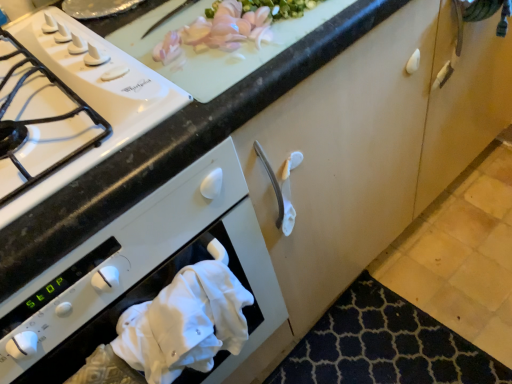
Measure the distance between dark blue textured mat at lower right and camera.

dark blue textured mat at lower right and camera are 3.58 feet apart from each other.

This screenshot has height=384, width=512. Identify the location of white cotton hand towel at lower left. (185, 323).

From a real-world perspective, is white fabric at lower left on top of white cotton hand towel at lower left?

No, from a real-world perspective, white fabric at lower left is not above white cotton hand towel at lower left.

Between white fabric at lower left and white cotton hand towel at lower left, which one appears on the left side from the viewer's perspective?

white fabric at lower left is more to the left.

Is white cotton hand towel at lower left inside white fabric at lower left?

Yes, white fabric at lower left contains white cotton hand towel at lower left.

I want to click on hand towel on the right of white fabric at lower left, so click(185, 323).

Considering the relative sizes of white cotton hand towel at lower left and dark blue textured mat at lower right in the image provided, is white cotton hand towel at lower left wider than dark blue textured mat at lower right?

Incorrect, the width of white cotton hand towel at lower left does not surpass that of dark blue textured mat at lower right.

Is there a large distance between white cotton hand towel at lower left and dark blue textured mat at lower right?

They are positioned close to each other.

Does white cotton hand towel at lower left have a greater height compared to dark blue textured mat at lower right?

Correct, white cotton hand towel at lower left is much taller as dark blue textured mat at lower right.

From a real-world perspective, does white cotton hand towel at lower left stand above dark blue textured mat at lower right?

Yes, from a real-world perspective, white cotton hand towel at lower left is above dark blue textured mat at lower right.

Is white cloth at lower left wider than dark blue textured mat at lower right?

In fact, white cloth at lower left might be narrower than dark blue textured mat at lower right.

Consider the image. Is white cloth at lower left next to dark blue textured mat at lower right?

There is a gap between white cloth at lower left and dark blue textured mat at lower right.

This screenshot has height=384, width=512. Identify the location of hand lying above the dark blue textured mat at lower right (from the image's perspective). tap(106, 369).

Is white cloth at lower left facing towards dark blue textured mat at lower right?

No, white cloth at lower left is not aimed at dark blue textured mat at lower right.

From a real-world perspective, is white fabric at lower left above or below dark blue textured mat at lower right?

In terms of real-world spatial position, white fabric at lower left is above dark blue textured mat at lower right.

Based on the photo, which is closer, (x=165, y=220) or (x=504, y=379)?

The point (x=165, y=220) is closer to the camera.

Is dark blue textured mat at lower right completely or partially inside white fabric at lower left?

No, dark blue textured mat at lower right is not surrounded by white fabric at lower left.

Between white fabric at lower left and dark blue textured mat at lower right, which one appears on the left side from the viewer's perspective?

From the viewer's perspective, white fabric at lower left appears more on the left side.

Is white cotton hand towel at lower left positioned with its back to white fabric at lower left?

Yes, white cotton hand towel at lower left is positioned with its back facing white fabric at lower left.

Is white cotton hand towel at lower left in front of or behind white fabric at lower left in the image?

white cotton hand towel at lower left is positioned farther from the viewer than white fabric at lower left.

I want to click on hand towel above the white fabric at lower left (from the image's perspective), so click(x=185, y=323).

Between white fabric at lower left and white glossy gas stove at left, which one has smaller width?

white glossy gas stove at left.

From the image's perspective, is white fabric at lower left beneath white glossy gas stove at left?

Yes, from the image's perspective, white fabric at lower left is below white glossy gas stove at left.

Is white glossy gas stove at left located within white fabric at lower left?

No, white glossy gas stove at left is not a part of white fabric at lower left.

Is white fabric at lower left to the left or to the right of white glossy gas stove at left in the image?

In the image, white fabric at lower left appears on the right side of white glossy gas stove at left.

Between point (487, 365) and point (266, 249), which one is positioned behind?

The point (487, 365) is behind.

Would you say dark blue textured mat at lower right contains white fabric at lower left?

No, white fabric at lower left is not surrounded by dark blue textured mat at lower right.

Does dark blue textured mat at lower right have a lesser height compared to white fabric at lower left?

Yes, dark blue textured mat at lower right is shorter than white fabric at lower left.

At what (x,y) coordinates should I click in order to perform the action: click on mat directly beneath the white fabric at lower left (from a real-world perspective). Please return your answer as a coordinate pair (x, y). Looking at the image, I should click on coord(384,345).

You are a GUI agent. You are given a task and a screenshot of the screen. Output one action in this format:
    pyautogui.click(x=<x>, y=<y>)
    Task: Click on the oven that is below the white cotton hand towel at lower left (from the image's perspective)
    Image resolution: width=512 pixels, height=384 pixels.
    Given the screenshot: What is the action you would take?
    pyautogui.click(x=141, y=275)

Where is `mat on the right of white cotton hand towel at lower left`? The image size is (512, 384). mat on the right of white cotton hand towel at lower left is located at coordinates (x=384, y=345).

Which object lies nearer to the anchor point white cloth at lower left, white cotton hand towel at lower left or dark blue textured mat at lower right?

Among the two, white cotton hand towel at lower left is located nearer to white cloth at lower left.

Consider the image. Which object lies nearer to the anchor point white fabric at lower left, white cloth at lower left or white glossy gas stove at left?

white cloth at lower left is closer to white fabric at lower left.

Which object lies further to the anchor point white cloth at lower left, white fabric at lower left or white glossy gas stove at left?

white glossy gas stove at left is further to white cloth at lower left.

Estimate the real-world distances between objects in this image. Which object is further from white cloth at lower left, white fabric at lower left or white cotton hand towel at lower left?

white fabric at lower left.

From the picture: Estimate the real-world distances between objects in this image. Which object is closer to dark blue textured mat at lower right, white cloth at lower left or white fabric at lower left?

white fabric at lower left.

Which object lies further to the anchor point white fabric at lower left, white cotton hand towel at lower left or white cloth at lower left?

Based on the image, white cloth at lower left appears to be further to white fabric at lower left.

In the scene shown: Which object lies nearer to the anchor point white glossy gas stove at left, white fabric at lower left or white cloth at lower left?

Among the two, white fabric at lower left is located nearer to white glossy gas stove at left.

From the image, which object appears to be farther from white cotton hand towel at lower left, white glossy gas stove at left or white cloth at lower left?

The object further to white cotton hand towel at lower left is white glossy gas stove at left.

Locate an element on the screen. This screenshot has width=512, height=384. hand between white fabric at lower left and white cotton hand towel at lower left from left to right is located at coordinates (106, 369).

What are the coordinates of `oven situated between white glossy gas stove at left and dark blue textured mat at lower right from left to right` in the screenshot? It's located at (141, 275).

Where is `hand towel between white glossy gas stove at left and white cloth at lower left in the up-down direction`? The width and height of the screenshot is (512, 384). hand towel between white glossy gas stove at left and white cloth at lower left in the up-down direction is located at coordinates (185, 323).

This screenshot has height=384, width=512. What are the coordinates of `oven between white glossy gas stove at left and white cloth at lower left vertically` in the screenshot? It's located at (141, 275).